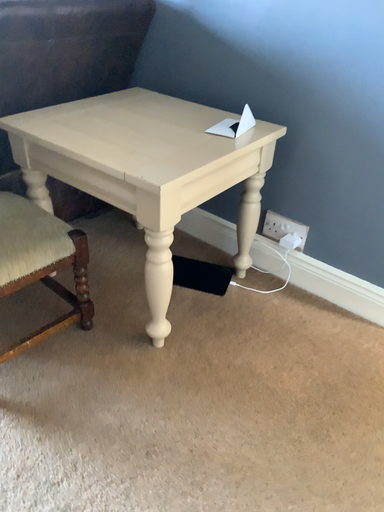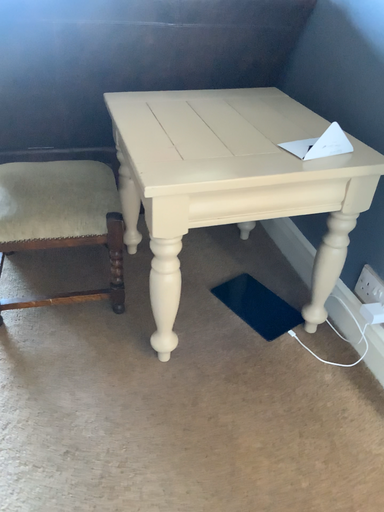
Question: How did the camera likely rotate when shooting the video?

Choices:
 (A) rotated left
 (B) rotated right

Answer: (A)